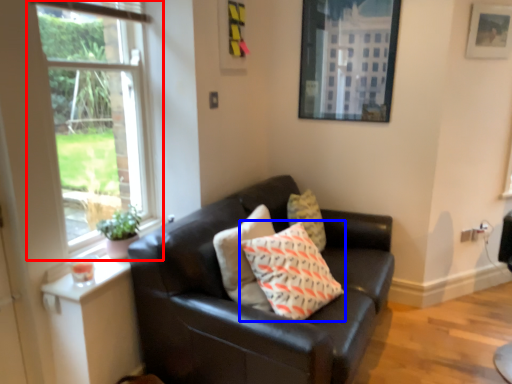
Question: Which point is closer to the camera, window (highlighted by a red box) or pillow (highlighted by a blue box)?

Choices:
 (A) window
 (B) pillow

Answer: (A)